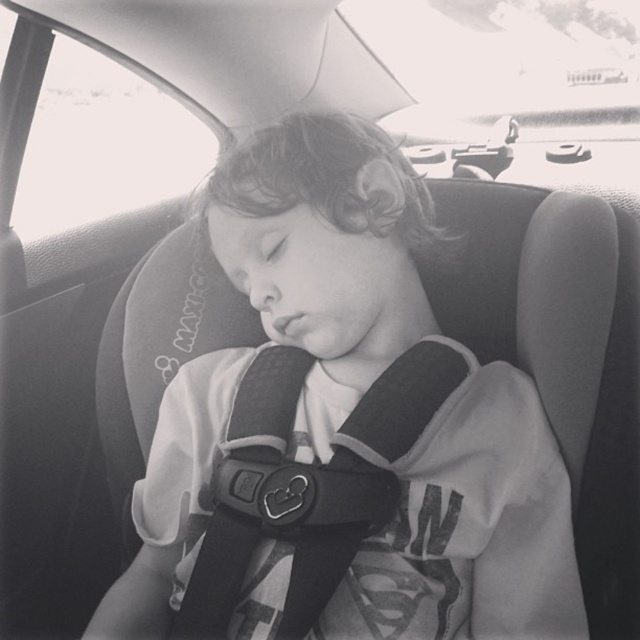
Does point (384, 625) come behind point (307, 493)?

That is False.

Which is below, smooth fabric shirt at center or black fabric seatbelt at center?

black fabric seatbelt at center is below.

Measure the distance between smooth fabric shirt at center and camera.

29.89 inches

The width and height of the screenshot is (640, 640). Find the location of `smooth fabric shirt at center`. smooth fabric shirt at center is located at coordinates (324, 253).